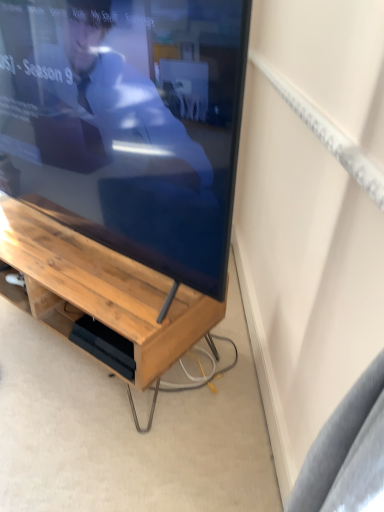
What do you see at coordinates (128, 124) in the screenshot? I see `matte wood tv at center` at bounding box center [128, 124].

This screenshot has height=512, width=384. Find the location of `matte wood tv at center`. matte wood tv at center is located at coordinates (128, 124).

You are a GUI agent. You are given a task and a screenshot of the screen. Output one action in this format:
    pyautogui.click(x=<x>, y=<y>)
    Task: Click on the wooden desk at center
    Image resolution: width=384 pixels, height=512 pixels.
    Given the screenshot: What is the action you would take?
    pyautogui.click(x=104, y=291)

Measure the distance between wooden desk at center and camera.

wooden desk at center and camera are 1.13 meters apart.

Describe the element at coordinates (104, 291) in the screenshot. I see `wooden desk at center` at that location.

Where is `matte wood tv at center`? This screenshot has width=384, height=512. matte wood tv at center is located at coordinates (128, 124).

Can you confirm if matte wood tv at center is positioned to the right of wooden desk at center?

Correct, you'll find matte wood tv at center to the right of wooden desk at center.

Which is behind, matte wood tv at center or wooden desk at center?

wooden desk at center is more distant.

Is point (227, 102) positioned in front of point (112, 279)?

Yes, it is in front of point (112, 279).

From the image's perspective, which one is positioned higher, matte wood tv at center or wooden desk at center?

matte wood tv at center, from the image's perspective.

From a real-world perspective, is matte wood tv at center positioned above or below wooden desk at center?

Clearly, from a real-world perspective, matte wood tv at center is above wooden desk at center.

Does matte wood tv at center have a lesser width compared to wooden desk at center?

Correct, the width of matte wood tv at center is less than that of wooden desk at center.

Can you confirm if matte wood tv at center is taller than wooden desk at center?

Yes, matte wood tv at center is taller than wooden desk at center.

Considering the relative sizes of matte wood tv at center and wooden desk at center in the image provided, is matte wood tv at center bigger than wooden desk at center?

Correct, matte wood tv at center is larger in size than wooden desk at center.

Can wooden desk at center be found inside matte wood tv at center?

No, wooden desk at center is located outside of matte wood tv at center.

Is matte wood tv at center next to wooden desk at center?

No, matte wood tv at center is not touching wooden desk at center.

Is matte wood tv at center facing away from wooden desk at center?

matte wood tv at center does not have its back to wooden desk at center.

Image resolution: width=384 pixels, height=512 pixels. In order to click on desk lying on the left of matte wood tv at center in this screenshot , I will do `click(104, 291)`.

In the scene shown: Is wooden desk at center at the right side of matte wood tv at center?

No.

Is wooden desk at center behind matte wood tv at center?

Yes, wooden desk at center is further from the viewer.

Does point (104, 295) come in front of point (155, 172)?

No, (104, 295) is behind (155, 172).

From the image's perspective, would you say wooden desk at center is positioned over matte wood tv at center?

No, from the image's perspective, wooden desk at center is not on top of matte wood tv at center.

From a real-world perspective, is wooden desk at center positioned above or below matte wood tv at center?

wooden desk at center is below matte wood tv at center.

Considering the relative sizes of wooden desk at center and matte wood tv at center in the image provided, is wooden desk at center thinner than matte wood tv at center?

No, wooden desk at center is not thinner than matte wood tv at center.

Can you confirm if wooden desk at center is shorter than matte wood tv at center?

Correct, wooden desk at center is not as tall as matte wood tv at center.

Can you confirm if wooden desk at center is bigger than matte wood tv at center?

No, wooden desk at center is not bigger than matte wood tv at center.

Is matte wood tv at center completely or partially inside wooden desk at center?

No, matte wood tv at center is not inside wooden desk at center.

Is wooden desk at center placed right next to matte wood tv at center?

No, wooden desk at center is not touching matte wood tv at center.

Consider the image. Is wooden desk at center facing away from matte wood tv at center?

No, wooden desk at center is not facing away from matte wood tv at center.

How different are the orientations of wooden desk at center and matte wood tv at center in degrees?

The angular difference between wooden desk at center and matte wood tv at center is 7.1e-05 degrees.

Identify the location of desk below the matte wood tv at center (from the image's perspective). The image size is (384, 512). (104, 291).

In the image, there is a wooden desk at center. Identify the location of television above it (from the image's perspective). Image resolution: width=384 pixels, height=512 pixels. (128, 124).

I want to click on television to the right of wooden desk at center, so click(128, 124).